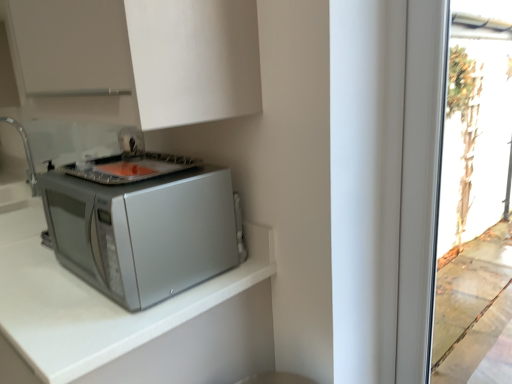
Question: Can you confirm if white matte cabinet at upper center is positioned to the left of brushed metal sink at left?

Choices:
 (A) no
 (B) yes

Answer: (A)

Question: Considering the relative sizes of white matte cabinet at upper center and brushed metal sink at left in the image provided, is white matte cabinet at upper center taller than brushed metal sink at left?

Choices:
 (A) no
 (B) yes

Answer: (B)

Question: Is white matte cabinet at upper center wider than brushed metal sink at left?

Choices:
 (A) yes
 (B) no

Answer: (A)

Question: From a real-world perspective, does white matte cabinet at upper center sit lower than brushed metal sink at left?

Choices:
 (A) yes
 (B) no

Answer: (B)

Question: Does white matte cabinet at upper center have a lesser width compared to brushed metal sink at left?

Choices:
 (A) yes
 (B) no

Answer: (B)

Question: Visually, is brushed metal sink at left positioned to the left or to the right of silver matte microwave at lower left?

Choices:
 (A) left
 (B) right

Answer: (A)

Question: Is brushed metal sink at left inside or outside of silver matte microwave at lower left?

Choices:
 (A) inside
 (B) outside

Answer: (B)

Question: In terms of width, does brushed metal sink at left look wider or thinner when compared to silver matte microwave at lower left?

Choices:
 (A) thin
 (B) wide

Answer: (A)

Question: Is point (31, 157) closer or farther from the camera than point (30, 215)?

Choices:
 (A) closer
 (B) farther

Answer: (B)

Question: Based on their positions, is satin silver microwave at lower left located to the left or right of brushed metal sink at left?

Choices:
 (A) left
 (B) right

Answer: (B)

Question: Considering their positions, is satin silver microwave at lower left located in front of or behind brushed metal sink at left?

Choices:
 (A) behind
 (B) front

Answer: (B)

Question: Based on their sizes in the image, would you say satin silver microwave at lower left is bigger or smaller than brushed metal sink at left?

Choices:
 (A) small
 (B) big

Answer: (B)

Question: Is satin silver microwave at lower left spatially inside brushed metal sink at left, or outside of it?

Choices:
 (A) outside
 (B) inside

Answer: (A)

Question: Does point (32, 172) appear closer or farther from the camera than point (139, 278)?

Choices:
 (A) farther
 (B) closer

Answer: (A)

Question: Relative to satin silver microwave at lower left, is brushed metal sink at left in front or behind?

Choices:
 (A) behind
 (B) front

Answer: (A)